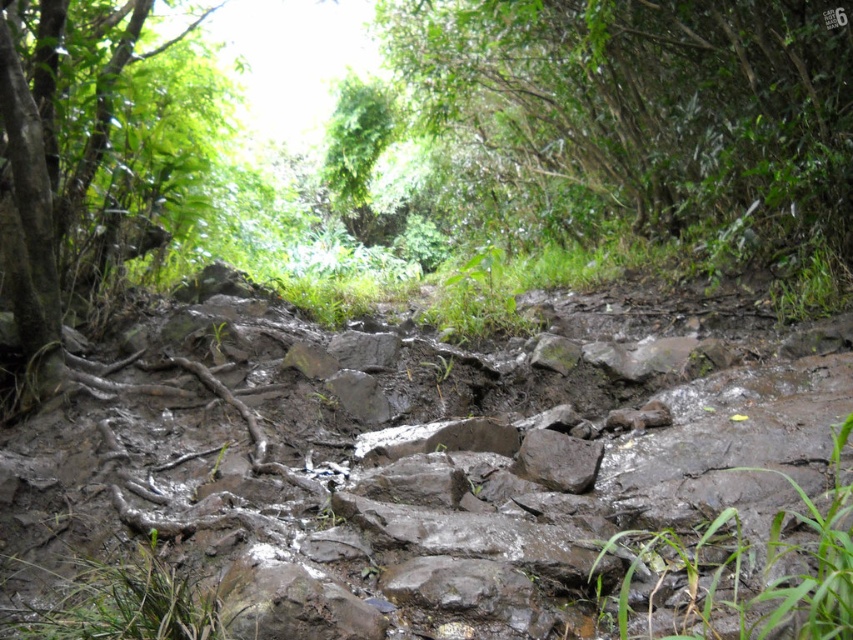
You are a hiker trying to navigate the trail and want to avoid the brown rough tree roots at left. Which direction should you move relative to the green leafy tree at upper center?

The green leafy tree at upper center is positioned on the right side of the brown rough tree roots at left. To avoid the brown rough tree roots at left, you should move to the right side of the green leafy tree at upper center.

You are hiking along the trail and want to take a photo of the green leafy tree at upper center and the brown rough tree roots at left. Which object should you focus on first if you want to capture both in a single frame without moving the camera?

The green leafy tree at upper center is located above the brown rough tree roots at left, so you should focus on the brown rough tree roots at left first to ensure both are in focus since it is closer to the camera.

Based on the photo, you are a hiker carrying a heavy backpack and want to take a break. You see the green leafy tree at upper center and the brown rough tree roots at left. Which one is farther from your current position?

The green leafy tree at upper center is farther from your current position because it is 5.63 meters away from the brown rough tree roots at left, implying the tree is further away than the roots.